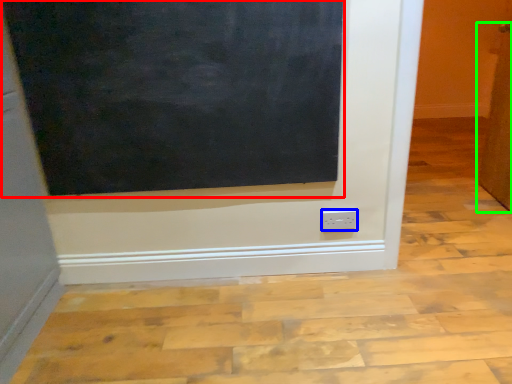
Question: Considering the real-world distances, which object is farthest from bulletin board (highlighted by a red box)? power plugs and sockets (highlighted by a blue box) or door (highlighted by a green box)?

Choices:
 (A) power plugs and sockets
 (B) door

Answer: (B)